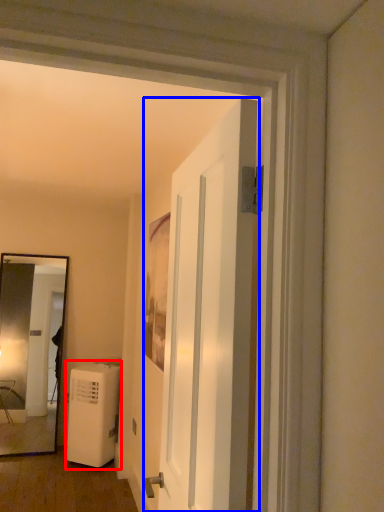
Question: Which object is further to the camera taking this photo, air conditioner (highlighted by a red box) or door (highlighted by a blue box)?

Choices:
 (A) air conditioner
 (B) door

Answer: (A)